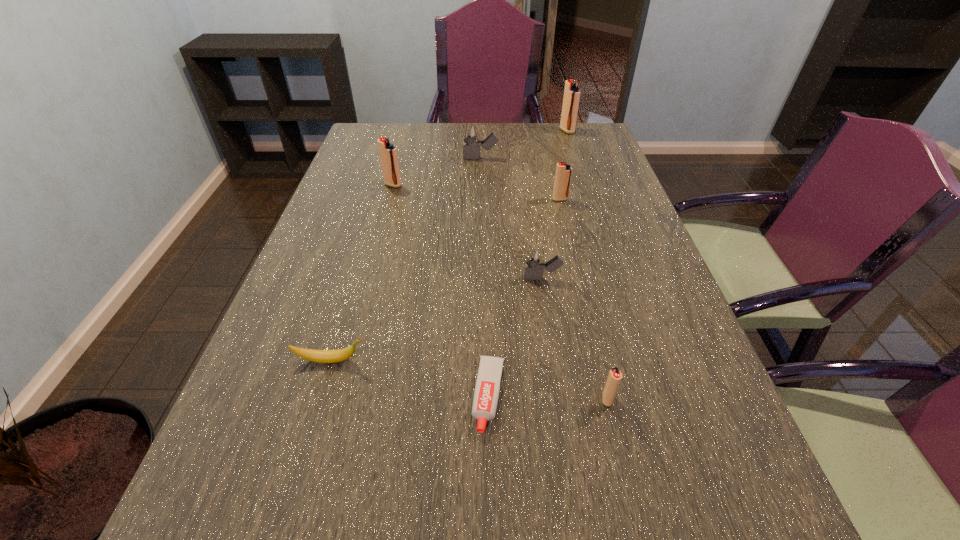
The width and height of the screenshot is (960, 540). In order to click on the farthest object in this screenshot , I will do `click(571, 98)`.

At what (x,y) coordinates should I click in order to perform the action: click on the biggest red igniter. Please return your answer as a coordinate pair (x, y). Looking at the image, I should click on (571, 98).

Image resolution: width=960 pixels, height=540 pixels. In order to click on the leftmost igniter in this screenshot , I will do `click(388, 152)`.

Identify the location of the fifth shortest igniter. This screenshot has height=540, width=960. (388, 152).

You are a GUI agent. You are given a task and a screenshot of the screen. Output one action in this format:
    pyautogui.click(x=<x>, y=<y>)
    Task: Click on the left gray igniter
    This screenshot has height=540, width=960.
    Given the screenshot: What is the action you would take?
    click(471, 132)

At what (x,y) coordinates should I click in order to perform the action: click on the farther gray igniter. Please return your answer as a coordinate pair (x, y). Image resolution: width=960 pixels, height=540 pixels. Looking at the image, I should click on (471, 132).

Find the location of a particular element. This screenshot has width=960, height=540. the third farthest red igniter is located at coordinates (563, 171).

The image size is (960, 540). In order to click on the third biggest red igniter in this screenshot , I will do tap(563, 171).

This screenshot has height=540, width=960. Find the location of `the nearest red igniter`. the nearest red igniter is located at coordinates (614, 377).

Image resolution: width=960 pixels, height=540 pixels. In order to click on the smallest red igniter in this screenshot , I will do `click(614, 377)`.